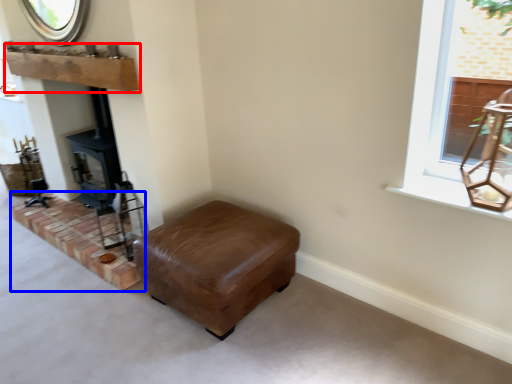
Question: Among these objects, which one is nearest to the camera, mantle (highlighted by a red box) or brickwork (highlighted by a blue box)?

Choices:
 (A) mantle
 (B) brickwork

Answer: (A)